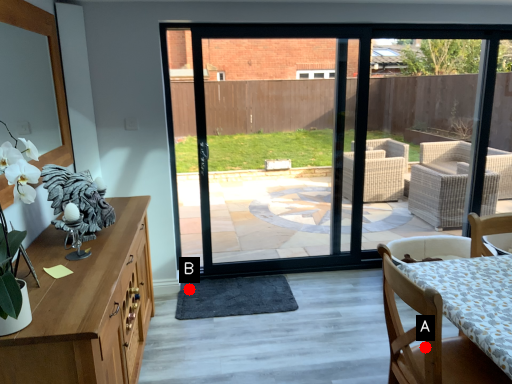
Question: Two points are circled on the image, labeled by A and B beside each circle. Which point appears farthest from the camera in this image?

Choices:
 (A) A is further
 (B) B is further

Answer: (B)